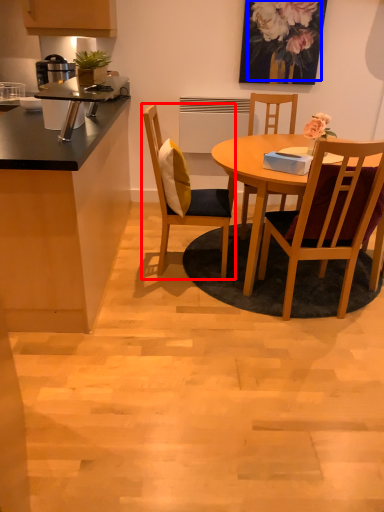
Question: Which of the following is the closest to the observer, chair (highlighted by a red box) or floral arrangement (highlighted by a blue box)?

Choices:
 (A) chair
 (B) floral arrangement

Answer: (A)